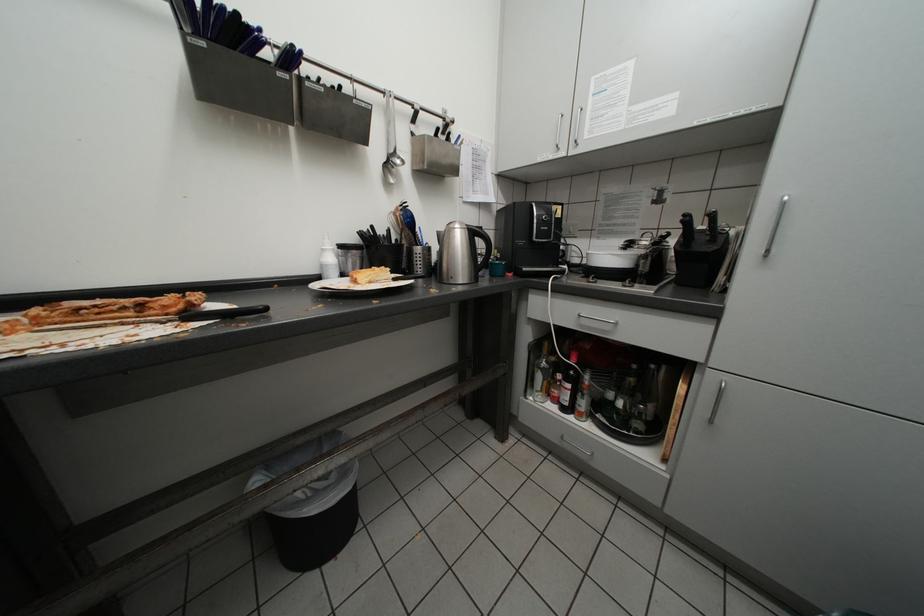
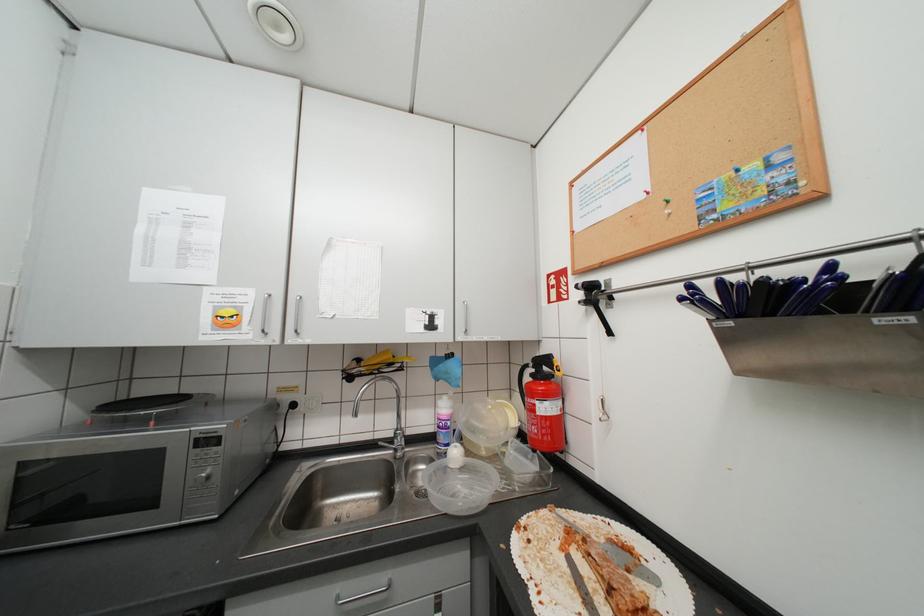
Question: The camera is either moving clockwise (left) or counter-clockwise (right) around the object. The first image is from the beginning of the video and the second image is from the end. Is the camera moving left or right when shooting the video?

Choices:
 (A) Left
 (B) Right

Answer: (B)